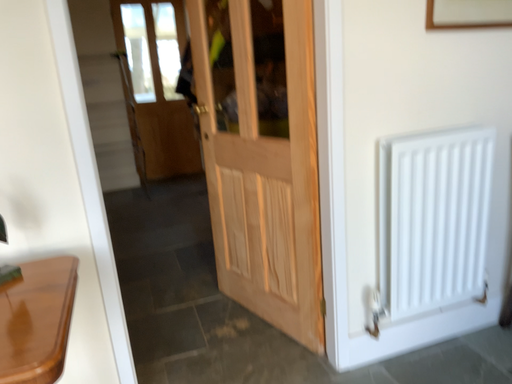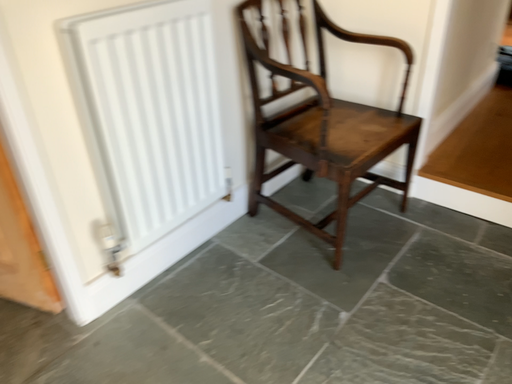
Question: Which way did the camera rotate in the video?

Choices:
 (A) rotated right
 (B) rotated left

Answer: (A)